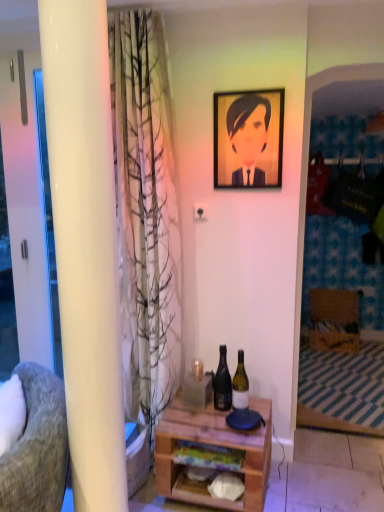
Question: Can you confirm if green glass bottle at center, the 2th bottle when ordered from left to right, is wider than wooden desk at center?

Choices:
 (A) no
 (B) yes

Answer: (A)

Question: Is wooden desk at center inside green glass bottle at center, the first bottle viewed from the right?

Choices:
 (A) yes
 (B) no

Answer: (B)

Question: Can you confirm if green glass bottle at center, the 2th bottle when ordered from left to right, is taller than wooden desk at center?

Choices:
 (A) no
 (B) yes

Answer: (A)

Question: Does green glass bottle at center, the first bottle viewed from the right, come behind wooden desk at center?

Choices:
 (A) yes
 (B) no

Answer: (A)

Question: From the image's perspective, does green glass bottle at center, the 2th bottle when ordered from left to right, appear lower than wooden desk at center?

Choices:
 (A) yes
 (B) no

Answer: (B)

Question: In the image, is white glossy pillar at left on the left side or the right side of white glossy screen door at left?

Choices:
 (A) right
 (B) left

Answer: (A)

Question: Which is correct: white glossy pillar at left is inside white glossy screen door at left, or outside of it?

Choices:
 (A) inside
 (B) outside

Answer: (B)

Question: Looking at their shapes, would you say white glossy pillar at left is wider or thinner than white glossy screen door at left?

Choices:
 (A) wide
 (B) thin

Answer: (B)

Question: From a real-world perspective, is white glossy pillar at left physically located above or below white glossy screen door at left?

Choices:
 (A) above
 (B) below

Answer: (B)

Question: In the image, is wooden desk at center positioned in front of or behind white glossy screen door at left?

Choices:
 (A) front
 (B) behind

Answer: (A)

Question: From the image's perspective, is wooden desk at center located above or below white glossy screen door at left?

Choices:
 (A) below
 (B) above

Answer: (A)

Question: Considering the positions of wooden desk at center and white glossy screen door at left in the image, is wooden desk at center wider or thinner than white glossy screen door at left?

Choices:
 (A) thin
 (B) wide

Answer: (B)

Question: Would you say wooden desk at center is to the left or to the right of white glossy screen door at left in the picture?

Choices:
 (A) left
 (B) right

Answer: (B)

Question: From a real-world perspective, relative to wooden desk at center, is white glossy screen door at left vertically above or below?

Choices:
 (A) below
 (B) above

Answer: (B)

Question: Choose the correct answer: Is white glossy screen door at left inside wooden desk at center or outside it?

Choices:
 (A) inside
 (B) outside

Answer: (B)